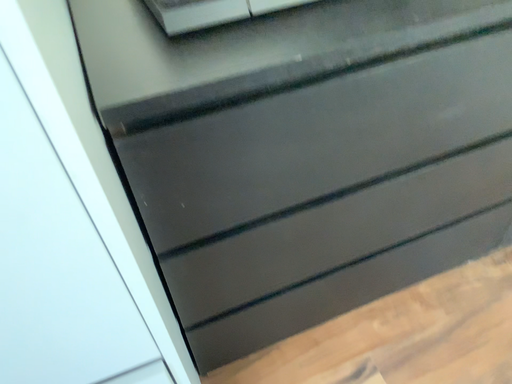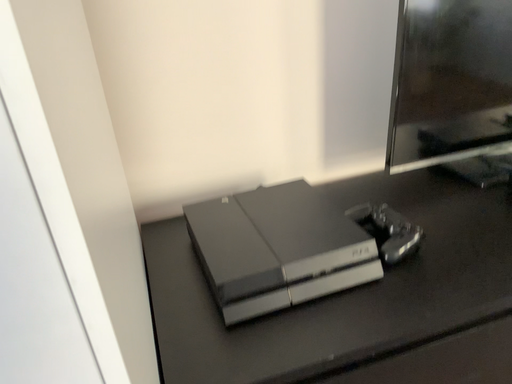
Question: Which way did the camera rotate in the video?

Choices:
 (A) rotated downward
 (B) rotated upward

Answer: (B)